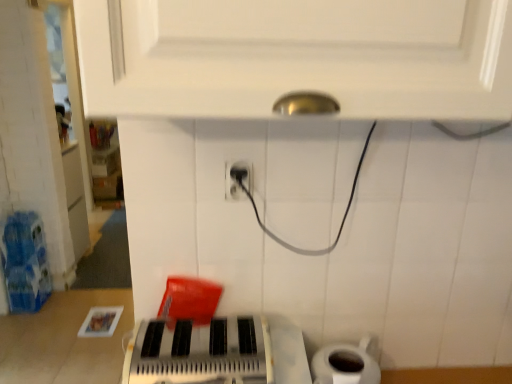
Question: Is metallic silver keyboard at center to the left or to the right of black plastic power plug at center in the image?

Choices:
 (A) left
 (B) right

Answer: (A)

Question: In terms of width, does metallic silver keyboard at center look wider or thinner when compared to black plastic power plug at center?

Choices:
 (A) thin
 (B) wide

Answer: (B)

Question: Estimate the real-world distances between objects in this image. Which object is closer to the metallic silver keyboard at center?

Choices:
 (A) black plastic power plug at center
 (B) white matte toilet paper at lower right

Answer: (B)

Question: Based on their relative distances, which object is nearer to the white matte toilet paper at lower right?

Choices:
 (A) black plastic power plug at center
 (B) metallic silver keyboard at center

Answer: (B)